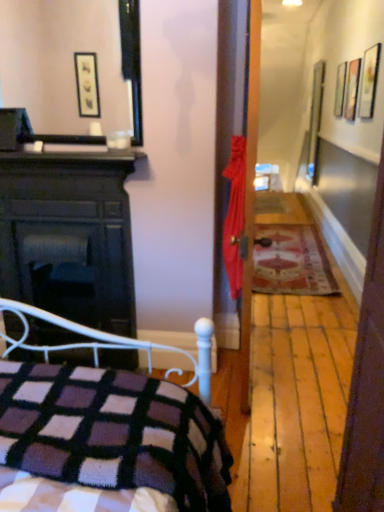
This screenshot has height=512, width=384. In order to click on dark wood fireplace at left in this screenshot , I will do `click(69, 236)`.

Image resolution: width=384 pixels, height=512 pixels. Identify the location of dark wood fireplace at left. (69, 236).

Where is `picture frame located above the knitted wool blanket at lower left (from the image's perspective)`? picture frame located above the knitted wool blanket at lower left (from the image's perspective) is located at coordinates 340,89.

Consider the image. Measure the distance from wooden picture frame at upper right to knitted wool blanket at lower left.

wooden picture frame at upper right and knitted wool blanket at lower left are 11.11 feet apart from each other.

From their relative heights in the image, would you say wooden picture frame at upper right is taller or shorter than knitted wool blanket at lower left?

Clearly, wooden picture frame at upper right is taller compared to knitted wool blanket at lower left.

Is carpeted mat at hallway center not inside wooden picture frame at upper right?

That's correct, carpeted mat at hallway center is outside of wooden picture frame at upper right.

From the picture: From a real-world perspective, between carpeted mat at hallway center and wooden picture frame at upper right, who is vertically higher?

wooden picture frame at upper right is physically above.

From the image's perspective, who appears lower, carpeted mat at hallway center or wooden picture frame at upper right?

carpeted mat at hallway center, from the image's perspective.

Does carpeted mat at hallway center come behind wooden picture frame at upper right?

No, carpeted mat at hallway center is in front of wooden picture frame at upper right.

At what (x,y) coordinates should I click in order to perform the action: click on picture frame on the right of the carpeted mat at hallway center. Please return your answer as a coordinate pair (x, y). This screenshot has height=512, width=384. Looking at the image, I should click on [x=340, y=89].

Is wooden picture frame at upper right closer to camera compared to carpeted mat at hallway center?

No, wooden picture frame at upper right is behind carpeted mat at hallway center.

Looking at this image, considering the relative sizes of wooden picture frame at upper right and carpeted mat at hallway center in the image provided, is wooden picture frame at upper right shorter than carpeted mat at hallway center?

No.

Is carpeted mat at hallway center to the left of dark wood fireplace at left from the viewer's perspective?

No.

Which point is more distant from viewer, (x=284, y=285) or (x=117, y=216)?

The point (x=284, y=285) is more distant.

Considering the sizes of carpeted mat at hallway center and dark wood fireplace at left in the image, is carpeted mat at hallway center bigger or smaller than dark wood fireplace at left?

Clearly, carpeted mat at hallway center is smaller in size than dark wood fireplace at left.

From the image's perspective, between carpeted mat at hallway center and dark wood fireplace at left, who is located below?

carpeted mat at hallway center appears lower in the image.

Is wooden picture frame at upper right completely or partially outside of dark wood fireplace at left?

Yes, wooden picture frame at upper right is outside of dark wood fireplace at left.

Looking at their sizes, would you say wooden picture frame at upper right is wider or thinner than dark wood fireplace at left?

wooden picture frame at upper right is thinner than dark wood fireplace at left.

Can you confirm if wooden picture frame at upper right is taller than dark wood fireplace at left?

Incorrect, the height of wooden picture frame at upper right is not larger of that of dark wood fireplace at left.

Is wooden picture frame at upper right beside dark wood fireplace at left?

wooden picture frame at upper right and dark wood fireplace at left are clearly separated.

At what (x,y) coordinates should I click in order to perform the action: click on cabinetry that is behind the knitted wool blanket at lower left. Please return your answer as a coordinate pair (x, y). Looking at the image, I should click on (69, 236).

Choose the correct answer: Is dark wood fireplace at left inside knitted wool blanket at lower left or outside it?

dark wood fireplace at left lies outside knitted wool blanket at lower left.

Who is smaller, dark wood fireplace at left or knitted wool blanket at lower left?

With smaller size is dark wood fireplace at left.

From the picture: From a real-world perspective, which is physically above, dark wood fireplace at left or knitted wool blanket at lower left?

In real-world perspective, dark wood fireplace at left is above.

Is knitted wool blanket at lower left positioned with its back to wooden picture frame at upper right?

No, knitted wool blanket at lower left is not facing away from wooden picture frame at upper right.

Considering the sizes of knitted wool blanket at lower left and wooden picture frame at upper right in the image, is knitted wool blanket at lower left taller or shorter than wooden picture frame at upper right?

Considering their sizes, knitted wool blanket at lower left has less height than wooden picture frame at upper right.

From the picture: From the image's perspective, is knitted wool blanket at lower left on top of wooden picture frame at upper right?

No, from the image's perspective, knitted wool blanket at lower left is not above wooden picture frame at upper right.

Is knitted wool blanket at lower left positioned far away from wooden picture frame at upper right?

Yes, knitted wool blanket at lower left and wooden picture frame at upper right are located far from each other.

Locate an element on the screen. Image resolution: width=384 pixels, height=512 pixels. bed below the wooden picture frame at upper right (from a real-world perspective) is located at coordinates (113, 433).

The height and width of the screenshot is (512, 384). There is a carpeted mat at hallway center. In order to click on picture frame above it (from a real-world perspective) in this screenshot , I will do `click(340, 89)`.

Based on their spatial positions, is carpeted mat at hallway center or knitted wool blanket at lower left closer to wooden picture frame at upper right?

Based on the image, carpeted mat at hallway center appears to be nearer to wooden picture frame at upper right.

Based on the photo, which object lies nearer to the anchor point carpeted mat at hallway center, knitted wool blanket at lower left or dark wood fireplace at left?

dark wood fireplace at left is closer to carpeted mat at hallway center.

Looking at the image, which one is located further to knitted wool blanket at lower left, carpeted mat at hallway center or dark wood fireplace at left?

carpeted mat at hallway center.

When comparing their distances from knitted wool blanket at lower left, does wooden picture frame at upper right or dark wood fireplace at left seem closer?

dark wood fireplace at left lies closer to knitted wool blanket at lower left than the other object.

Estimate the real-world distances between objects in this image. Which object is closer to knitted wool blanket at lower left, dark wood fireplace at left or wooden picture frame at upper right?

dark wood fireplace at left is closer to knitted wool blanket at lower left.

When comparing their distances from dark wood fireplace at left, does wooden picture frame at upper right or knitted wool blanket at lower left seem further?

→ wooden picture frame at upper right is further to dark wood fireplace at left.

Considering their positions, is dark wood fireplace at left positioned closer to knitted wool blanket at lower left than carpeted mat at hallway center?

Based on the image, dark wood fireplace at left appears to be nearer to knitted wool blanket at lower left.

Considering their positions, is wooden picture frame at upper right positioned further to knitted wool blanket at lower left than carpeted mat at hallway center?

The object further to knitted wool blanket at lower left is wooden picture frame at upper right.

At what (x,y) coordinates should I click in order to perform the action: click on mat situated between dark wood fireplace at left and wooden picture frame at upper right from left to right. Please return your answer as a coordinate pair (x, y). Looking at the image, I should click on (292, 262).

Where is `cabinetry positioned between knitted wool blanket at lower left and wooden picture frame at upper right from near to far`? Image resolution: width=384 pixels, height=512 pixels. cabinetry positioned between knitted wool blanket at lower left and wooden picture frame at upper right from near to far is located at coordinates (69, 236).

Locate an element on the screen. This screenshot has height=512, width=384. mat between knitted wool blanket at lower left and wooden picture frame at upper right along the z-axis is located at coordinates (292, 262).

Where is `cabinetry located between knitted wool blanket at lower left and carpeted mat at hallway center in the depth direction`? cabinetry located between knitted wool blanket at lower left and carpeted mat at hallway center in the depth direction is located at coordinates (69, 236).